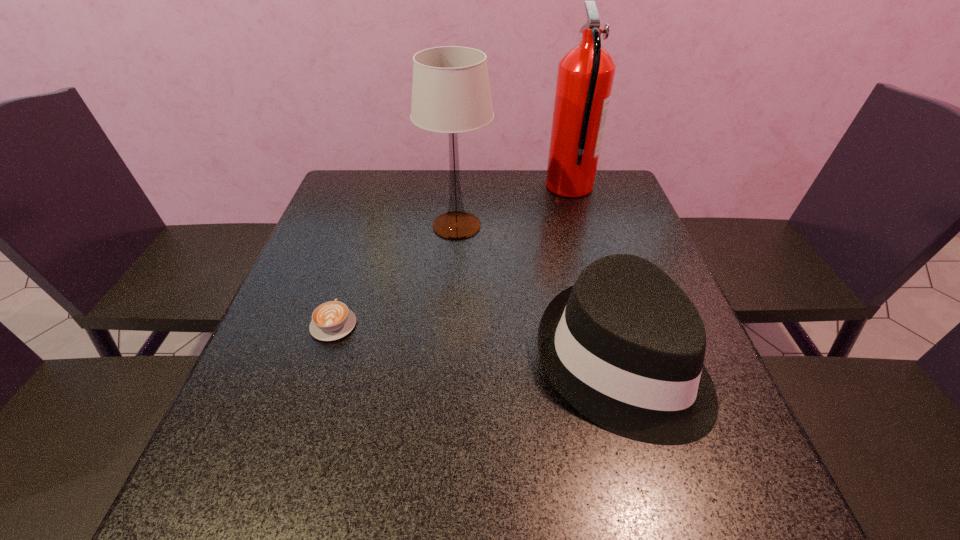
In the image, there is a desktop. In order to click on vacant region at the far edge in this screenshot , I will do `click(493, 183)`.

At what (x,y) coordinates should I click in order to perform the action: click on vacant position at the near edge of the desktop. Please return your answer as a coordinate pair (x, y). Looking at the image, I should click on (406, 487).

Locate an element on the screen. The height and width of the screenshot is (540, 960). free region at the left edge is located at coordinates (242, 456).

In the image, there is a desktop. Identify the location of vacant space at the right edge. (601, 231).

Image resolution: width=960 pixels, height=540 pixels. In order to click on free location at the far left corner in this screenshot , I will do `click(372, 177)`.

Locate an element on the screen. vacant space in between the cappuccino and the fedora is located at coordinates (477, 343).

Where is `free space that is in between the farthest object and the shortest object`? free space that is in between the farthest object and the shortest object is located at coordinates (451, 255).

You are a GUI agent. You are given a task and a screenshot of the screen. Output one action in this format:
    pyautogui.click(x=<x>, y=<y>)
    Task: Click on the vacant space in between the farthest object and the second object from left to right
    Image resolution: width=960 pixels, height=540 pixels.
    Given the screenshot: What is the action you would take?
    pyautogui.click(x=513, y=206)

Image resolution: width=960 pixels, height=540 pixels. Find the location of `free space that is in between the cappuccino and the fire extinguisher`. free space that is in between the cappuccino and the fire extinguisher is located at coordinates (451, 255).

At what (x,y) coordinates should I click in order to perform the action: click on free space between the farthest object and the cappuccino. Please return your answer as a coordinate pair (x, y). This screenshot has width=960, height=540. Looking at the image, I should click on (451, 255).